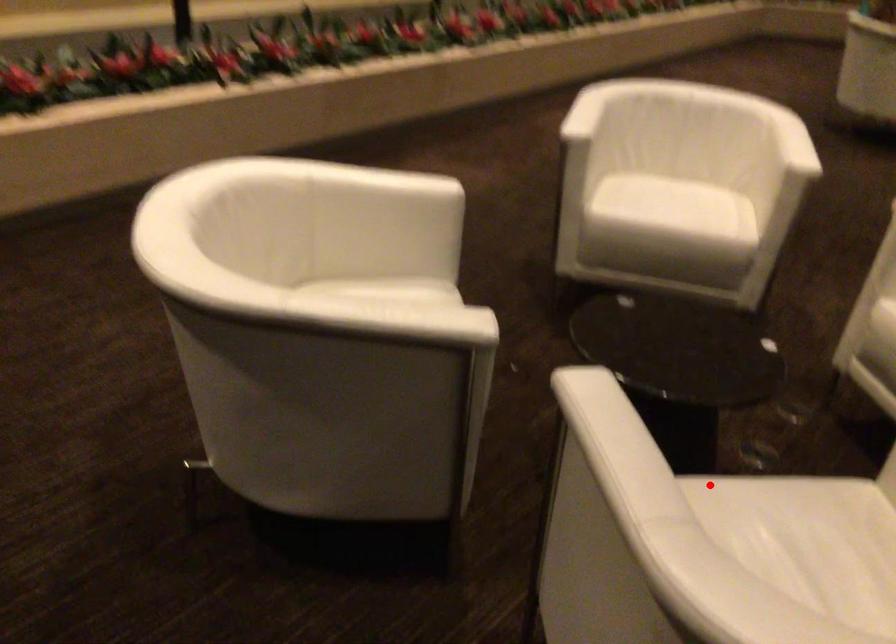
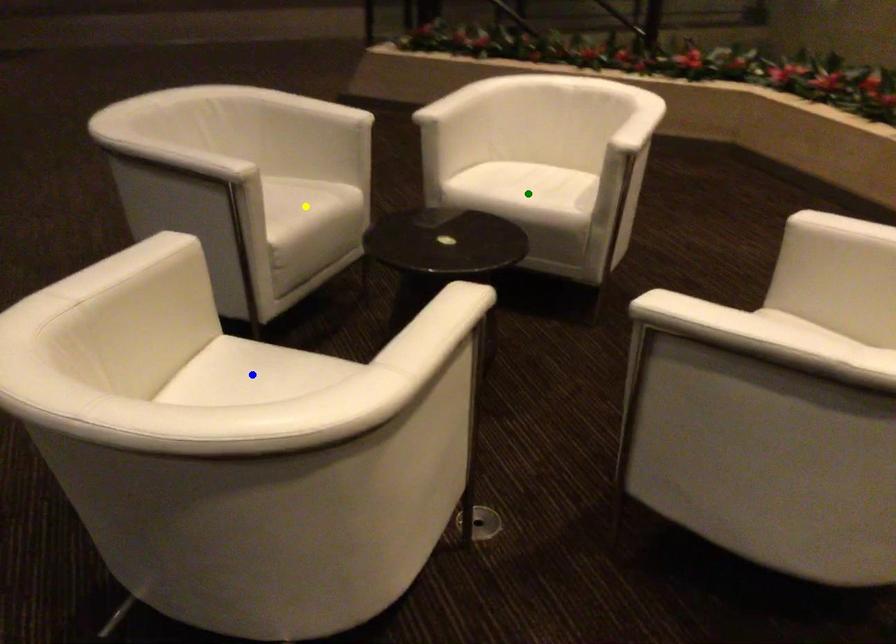
Question: I am providing you with two images of the same scene from different viewpoints. A red point is marked on the first image. You are given multiple points on the second image. Which point in image 2 represents the same 3d spot as the red point in image 1?

Choices:
 (A) blue point
 (B) green point
 (C) yellow point

Answer: (C)